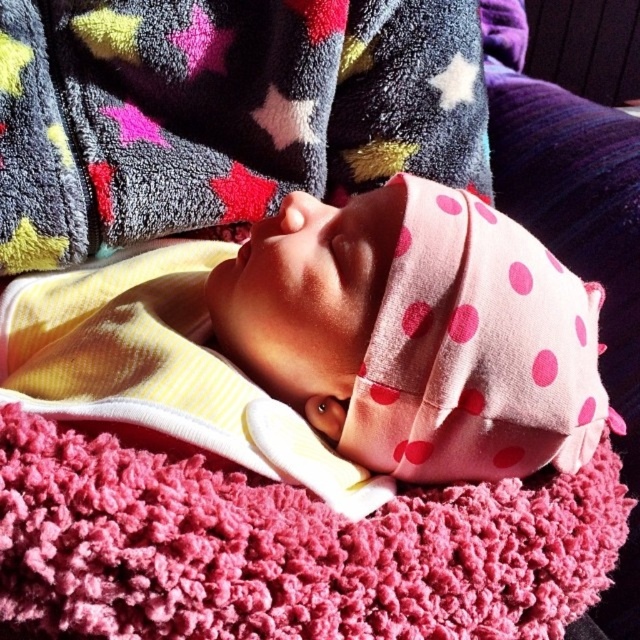
In the scene shown: You are a photographer setting up a shoot for a baby product catalog. You need to ensure that the pink polka dot fabric at center and the fluffy pink blanket at lower center are visible in the final shot. Based on their positions, which object should you focus on first to capture both in the frame?

The pink polka dot fabric at center should be focused on first since it is positioned on the left side of the fluffy pink blanket at lower center, ensuring both are within the frame when starting from the left.

You are holding a small stuffed animal that is 12 inches tall. You want to place it on the spot marked by point (176, 316). Can you reach that spot from your current position if you stretch your arm out fully, which has a maximum reach of 28 inches?

The distance between you and point (176, 316) is 27.45 inches, which is within your arm reach of 28 inches. Therefore, you can reach the spot to place the stuffed animal there.

You are a photographer taking a picture of the baby. You notice the pink polka dot fabric at center and the fluffy pink blanket at lower center. Which object is closer to your camera lens?

The pink polka dot fabric at center is closer to the camera lens because it is further to the viewer than the fluffy pink blanket at lower center.